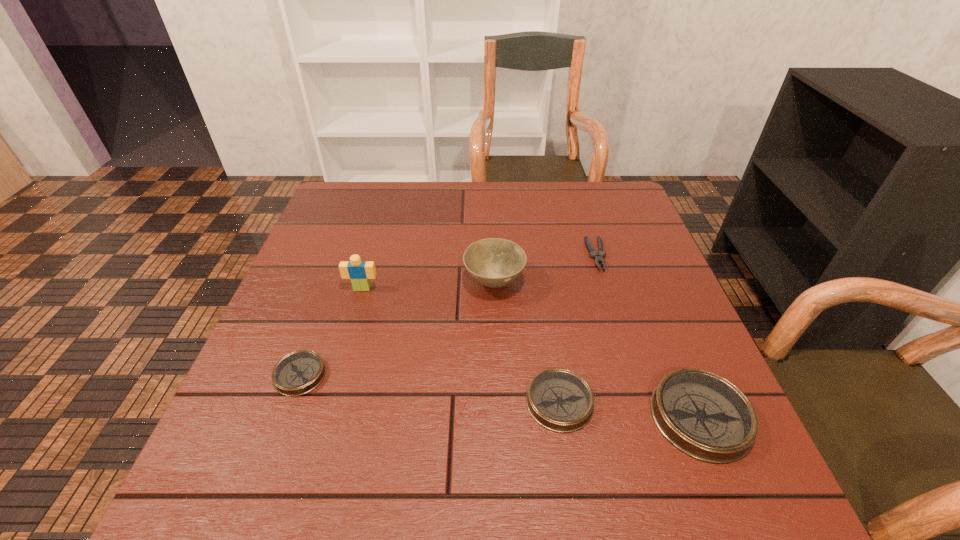
This screenshot has width=960, height=540. I want to click on free space that satisfies the following two spatial constraints: 1. on the face of the rightmost compass; 2. on the left side of the Lego, so click(x=325, y=417).

What are the coordinates of `free space that satisfies the following two spatial constraints: 1. at the gripping part of the pliers; 2. on the right side of the tallest compass` in the screenshot? It's located at (646, 417).